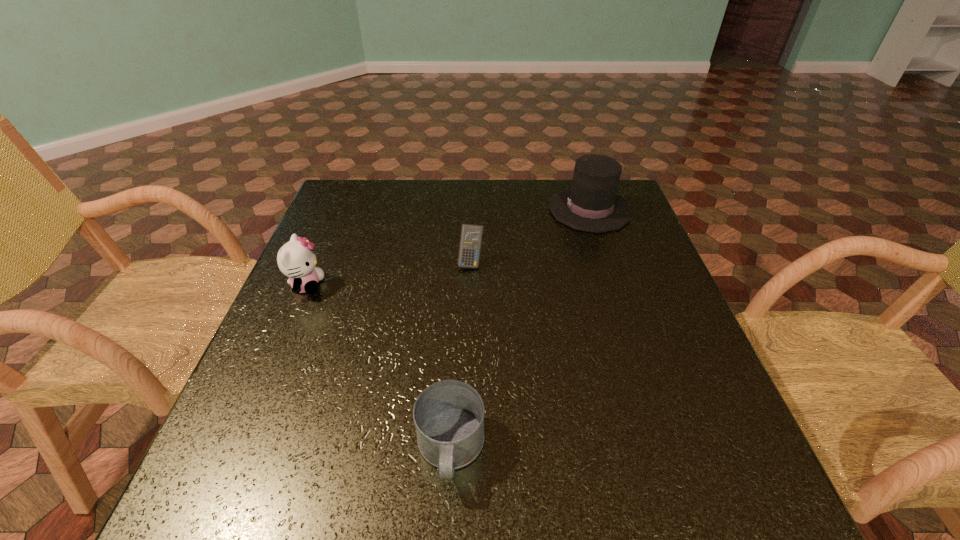
I want to click on vacant space at the far left corner of the desktop, so click(x=375, y=187).

In the image, there is a desktop. What are the coordinates of `vacant area at the near left corner` in the screenshot? It's located at (203, 487).

Where is `vacant region between the shortest object and the dress hat`? Image resolution: width=960 pixels, height=540 pixels. vacant region between the shortest object and the dress hat is located at coordinates pos(520,329).

Where is `vacant space that's between the farthest object and the third tallest object`? This screenshot has width=960, height=540. vacant space that's between the farthest object and the third tallest object is located at coordinates 530,236.

Where is `vacant space in between the mug and the dress hat`? vacant space in between the mug and the dress hat is located at coordinates (520, 329).

Find the location of `blank region between the rightmost object and the mug`. blank region between the rightmost object and the mug is located at coordinates (520, 329).

At what (x,y) coordinates should I click in order to perform the action: click on unoccupied area between the rightmost object and the mug. Please return your answer as a coordinate pair (x, y). Looking at the image, I should click on (520, 329).

Identify the location of vacant area that lies between the second shortest object and the mug. The width and height of the screenshot is (960, 540). (461, 356).

The width and height of the screenshot is (960, 540). I want to click on vacant area that lies between the mug and the dress hat, so click(520, 329).

I want to click on vacant area that lies between the leftmost object and the dress hat, so pyautogui.click(x=448, y=247).